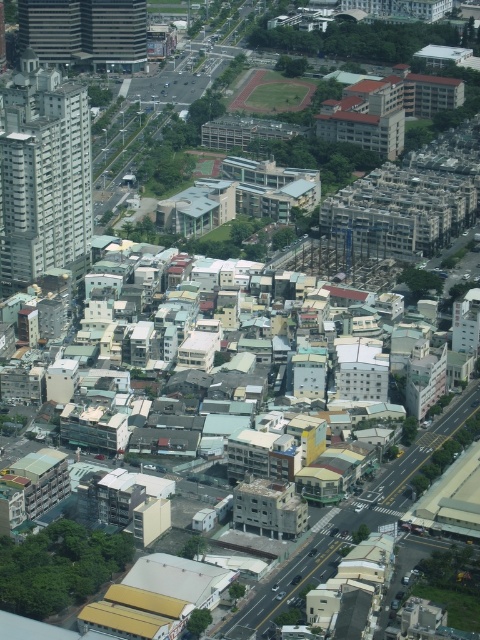
Question: Which point is closer to the camera?

Choices:
 (A) (76, 150)
 (B) (20, 42)

Answer: (A)

Question: Is gray concrete building at left smaller than matte glass skyscraper at upper left?

Choices:
 (A) yes
 (B) no

Answer: (B)

Question: Is gray concrete building at left to the left of matte glass skyscraper at upper left from the viewer's perspective?

Choices:
 (A) no
 (B) yes

Answer: (B)

Question: Is gray concrete building at left closer to camera compared to matte glass skyscraper at upper left?

Choices:
 (A) yes
 (B) no

Answer: (A)